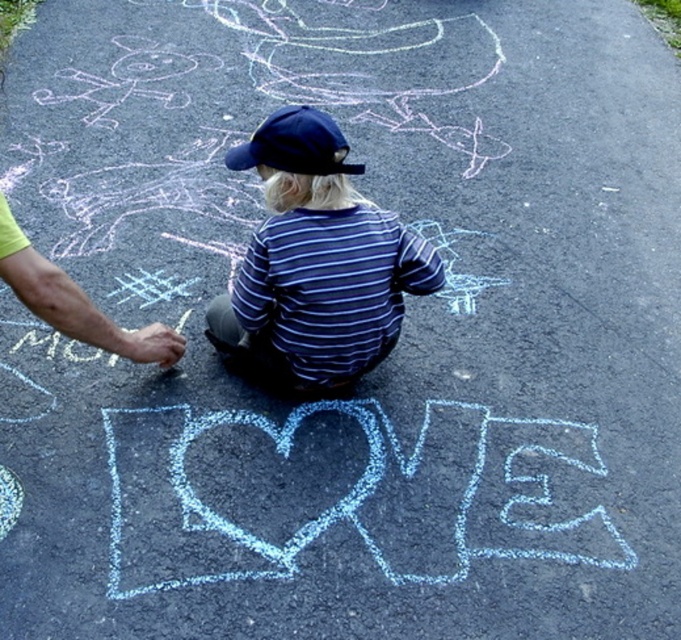
You are a photographer taking a picture of the scene. You want to ensure both the blue striped shirt at center and the navy blue fabric baseball cap at center are clearly visible. Which object should you focus on first to ensure the other is also in focus?

The blue striped shirt at center is located below the navy blue fabric baseball cap at center. Since they are vertically aligned, focusing on the navy blue fabric baseball cap at center first would ensure the blue striped shirt at center is also in focus due to their close proximity in depth.

You are a photographer taking a picture of the scene. You notice the blue striped shirt at center and the navy blue fabric baseball cap at center. Which object should you focus on first if you want to capture the taller one in the frame?

The blue striped shirt at center is taller than the navy blue fabric baseball cap at center, so you should focus on the blue striped shirt at center first to capture the taller one in the frame.

In the scene shown: You are standing at the center of the image and want to move towards the blue striped shirt at center. Which direction should you move to reach it?

The blue striped shirt at center is already at the center of the image, so you don not need to move in any direction to reach it.